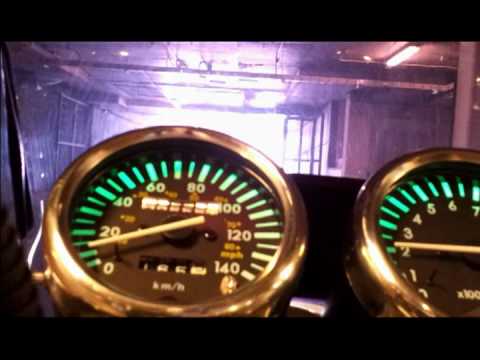
You are a GUI agent. You are given a task and a screenshot of the screen. Output one action in this format:
    pyautogui.click(x=<x>, y=<y>)
    Task: Click on the ceiling
    The height and width of the screenshot is (360, 480).
    Given the screenshot: What is the action you would take?
    pyautogui.click(x=234, y=57)